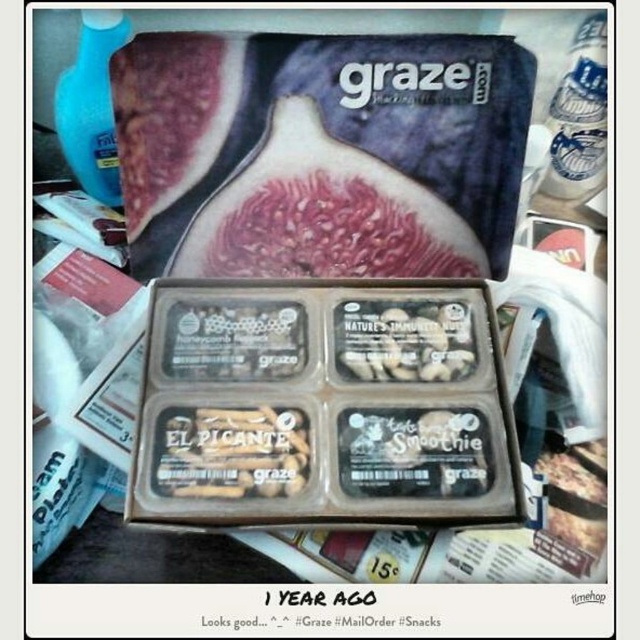
You are standing at the edge of the table where the Graze snack box is placed. You need to move an item from point (x=324, y=195) to point (x=465, y=356). Which direction should you move the item to reach the target point?

You should move the item forward because point (x=324, y=195) is behind point (x=465, y=356), so moving forward from the starting point will reach the target location.

You are organizing snacks on a table and notice the brown matte snack bar at center and the white matte nuts at center. Which snack is positioned lower on the table?

The brown matte snack bar at center is below the white matte nuts at center, so it is positioned lower on the table.

You are trying to identify snacks in the Graze snack box. You notice two items at the center of the box. Which one is taller, the fuzzy red fig at center or the white matte nuts at center?

The fuzzy red fig at center is taller than the white matte nuts at center.